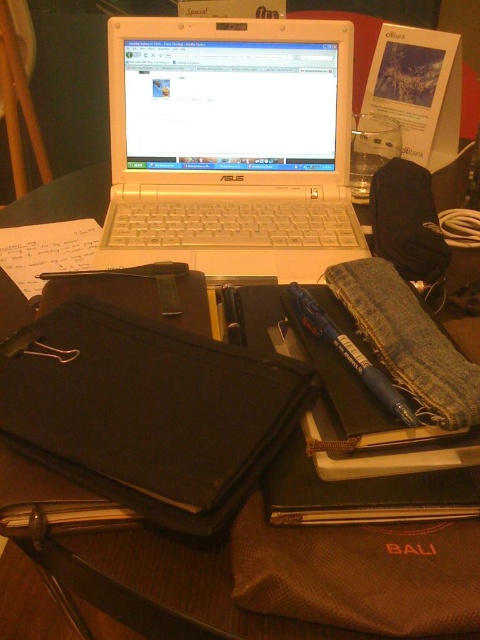
Which of these two, black fabric binder at lower left or metallic blue pen at center-right, stands shorter?

Standing shorter between the two is metallic blue pen at center-right.

Is black fabric binder at lower left thinner than metallic blue pen at center-right?

In fact, black fabric binder at lower left might be wider than metallic blue pen at center-right.

Which is in front, point (290, 394) or point (347, 380)?

Point (290, 394) is more forward.

Locate an element on the screen. The image size is (480, 640). black fabric binder at lower left is located at coordinates (146, 410).

Between white plastic laptop at center and black fabric binder at lower left, which one is positioned higher?

white plastic laptop at center is higher up.

Is white plastic laptop at center to the left of black fabric binder at lower left from the viewer's perspective?

Incorrect, white plastic laptop at center is not on the left side of black fabric binder at lower left.

What do you see at coordinates (230, 147) in the screenshot?
I see `white plastic laptop at center` at bounding box center [230, 147].

Where is `white plastic laptop at center`? This screenshot has width=480, height=640. white plastic laptop at center is located at coordinates (230, 147).

Based on the photo, between white plastic laptop at center and metallic blue pen at center-right, which one has less height?

With less height is metallic blue pen at center-right.

Does white plastic laptop at center come behind metallic blue pen at center-right?

Yes, it is behind metallic blue pen at center-right.

Locate an element on the screen. white plastic laptop at center is located at coordinates (230, 147).